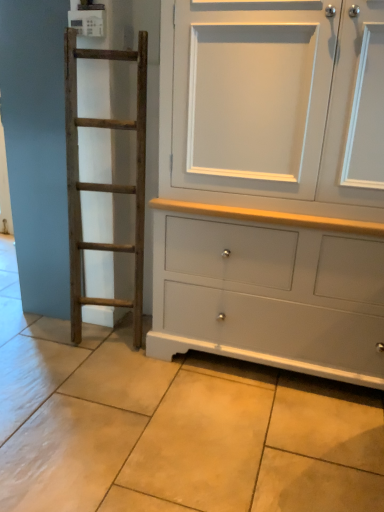
What is the approximate width of white painted wood chest of drawers at center?

58.22 centimeters.

What are the coordinates of `white painted wood chest of drawers at center` in the screenshot? It's located at (272, 185).

Measure the distance between point (356,27) and camera.

Point (356,27) is 1.30 meters away from camera.

What do you see at coordinates (272, 185) in the screenshot? Image resolution: width=384 pixels, height=512 pixels. I see `white painted wood chest of drawers at center` at bounding box center [272, 185].

Find the location of `white painted wood chest of drawers at center`. white painted wood chest of drawers at center is located at coordinates (272, 185).